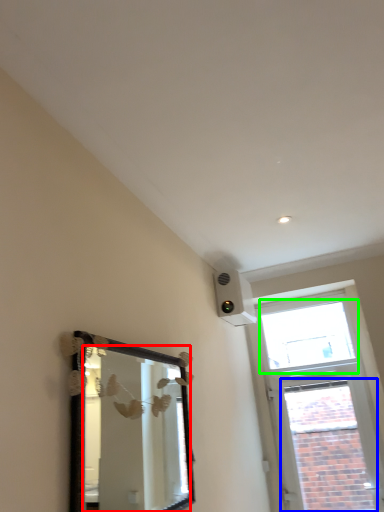
Question: Considering the real-world distances, which object is farthest from mirror (highlighted by a red box)? window (highlighted by a blue box) or window (highlighted by a green box)?

Choices:
 (A) window
 (B) window

Answer: (B)